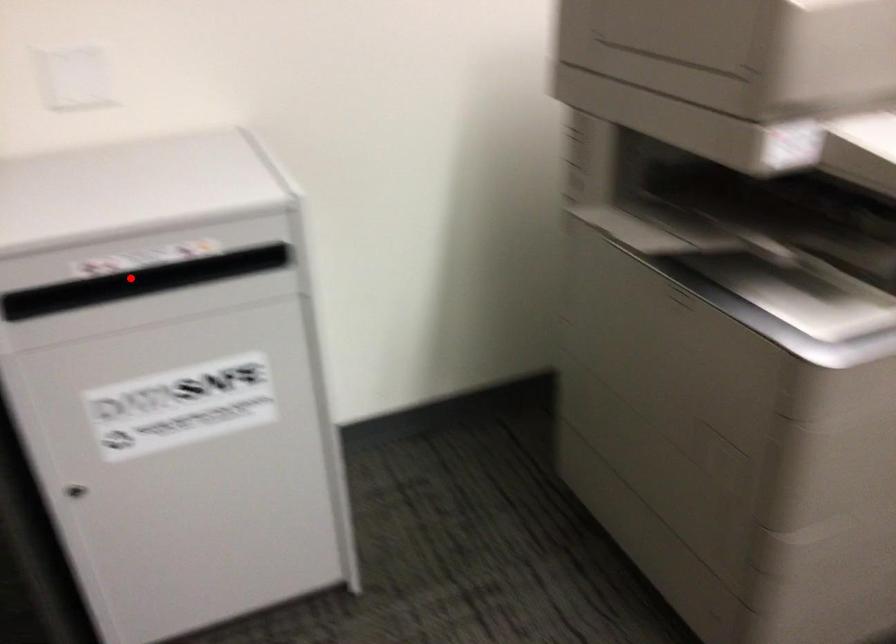
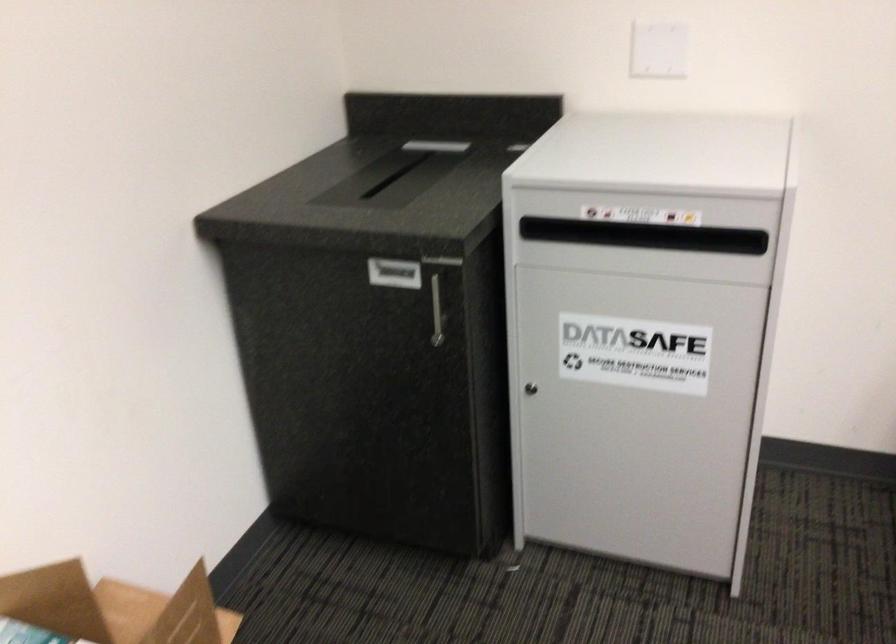
Question: I am providing you with two images of the same scene from different viewpoints. A red point is shown in image1. For the corresponding object point in image2, is it positioned nearer or farther from the camera?

Choices:
 (A) Nearer
 (B) Farther

Answer: (B)